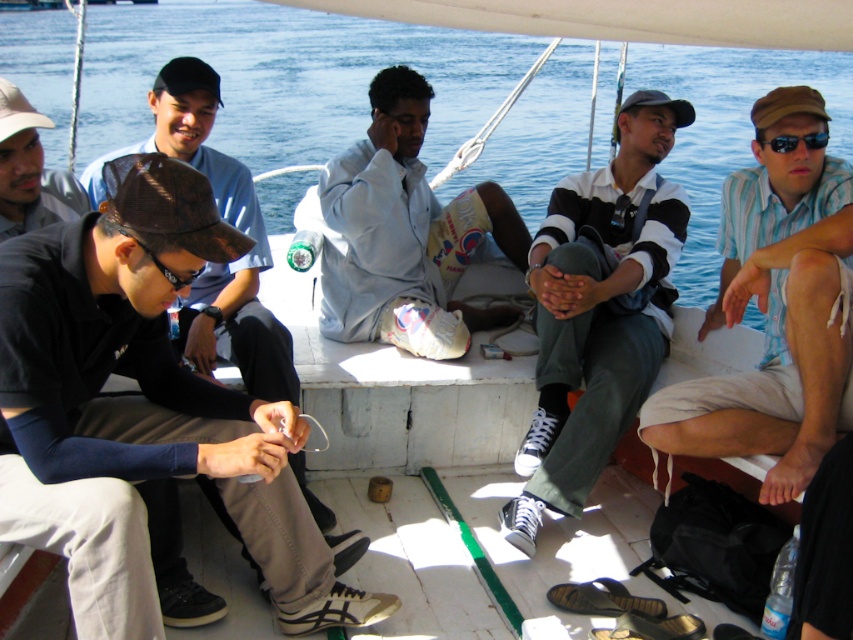
Question: Which of the following is the closest to the observer?

Choices:
 (A) (451, 339)
 (B) (201, 108)
 (C) (668, 147)

Answer: (B)

Question: Is light blue fabric shirt at center wider than dark brown leather cap at left?

Choices:
 (A) yes
 (B) no

Answer: (A)

Question: From the image, what is the correct spatial relationship of striped cotton shirt at center in relation to light blue fabric shirt at center?

Choices:
 (A) left
 (B) right

Answer: (B)

Question: Which point appears closest to the camera in this image?

Choices:
 (A) (410, 342)
 (B) (527, 276)
 (C) (848, 323)

Answer: (C)

Question: Which point is closer to the camera taking this photo?

Choices:
 (A) (289, 355)
 (B) (361, 328)
 (C) (518, 532)

Answer: (A)

Question: Does striped cotton shirt at right lie in front of light blue fabric shirt at center?

Choices:
 (A) no
 (B) yes

Answer: (B)